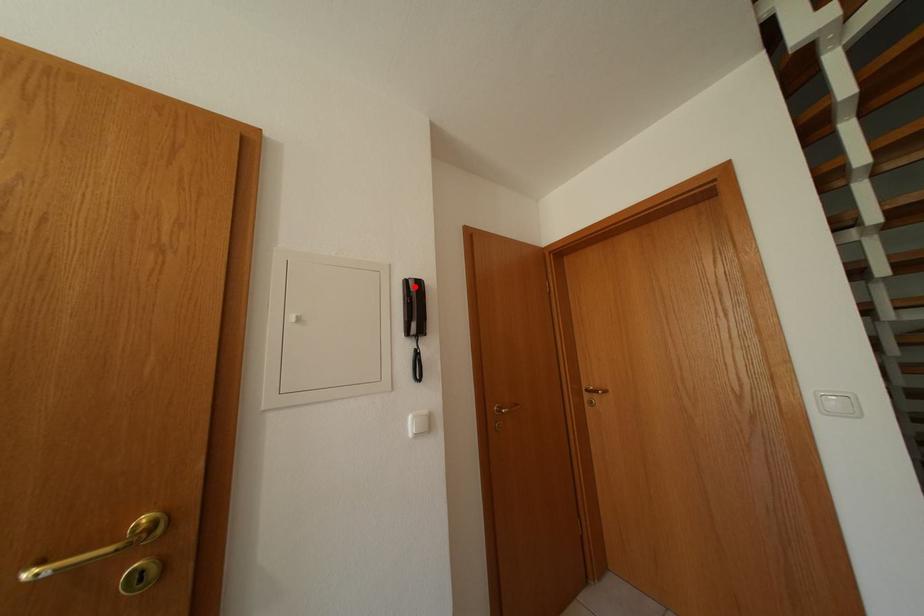
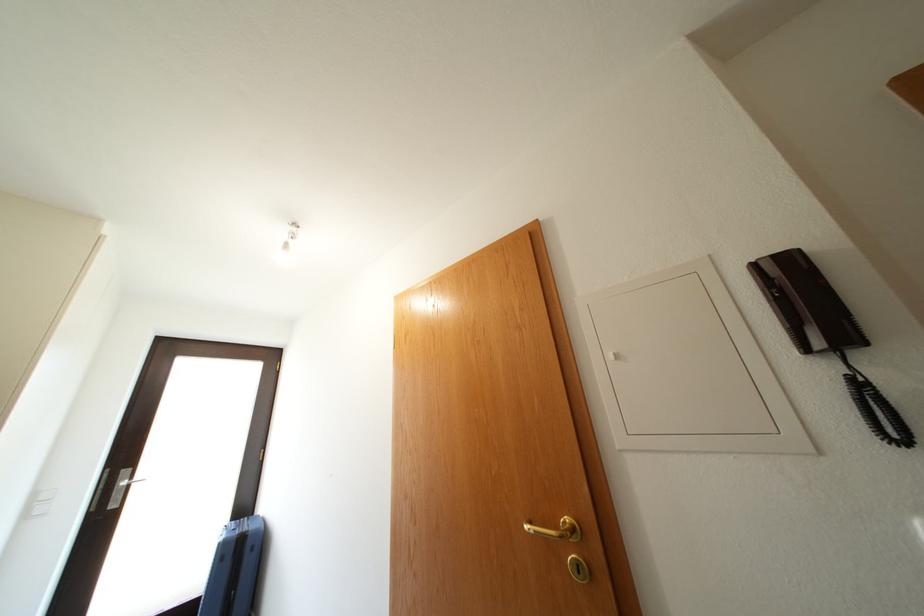
Locate, in the second image, the point that corresponds to the highlighted location in the first image.

(763, 272)